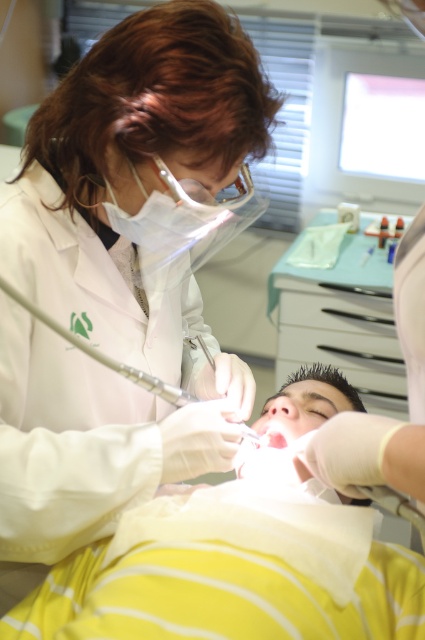
Question: Is yellow striped fabric at lower center to the left of metallic/transparent dental drill at center from the viewer's perspective?

Choices:
 (A) yes
 (B) no

Answer: (B)

Question: Which object appears farthest from the camera in this image?

Choices:
 (A) pink glossy lips at center
 (B) metallic/transparent dental drill at center
 (C) yellow striped fabric at lower center

Answer: (A)

Question: Considering the real-world distances, which object is farthest from the pink glossy lips at center?

Choices:
 (A) metallic/transparent dental drill at center
 (B) yellow striped fabric at lower center

Answer: (A)

Question: Which point is closer to the camera?

Choices:
 (A) (218, 524)
 (B) (263, 433)

Answer: (A)

Question: Does metallic/transparent dental drill at center lie behind pink glossy lips at center?

Choices:
 (A) no
 (B) yes

Answer: (A)

Question: Does yellow striped fabric at lower center have a smaller size compared to metallic/transparent dental drill at center?

Choices:
 (A) no
 (B) yes

Answer: (A)